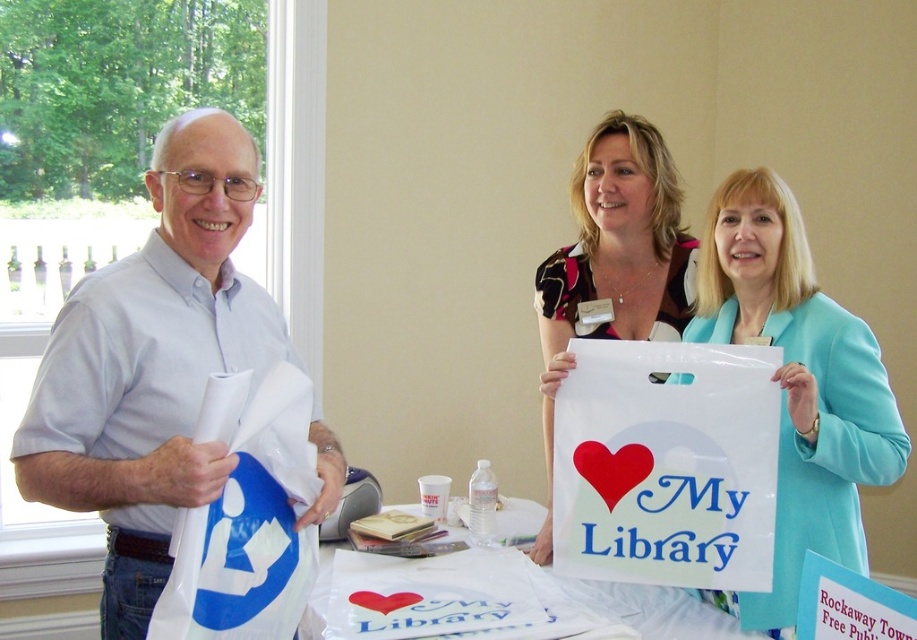
Does printed fabric heart at center have a smaller size compared to white plastic bag at center?

Incorrect, printed fabric heart at center is not smaller in size than white plastic bag at center.

How much distance is there between printed fabric heart at center and white plastic bag at center?

printed fabric heart at center is 26.14 inches from white plastic bag at center.

Who is more forward, (685, 257) or (558, 579)?

Point (558, 579) is more forward.

Locate an element on the screen. The width and height of the screenshot is (917, 640). printed fabric heart at center is located at coordinates (613, 260).

In the scene shown: How distant is teal fabric jacket at center from white plastic bag at center?

The distance of teal fabric jacket at center from white plastic bag at center is 17.19 inches.

Who is more forward, (810, 362) or (724, 614)?

Point (810, 362)

At what (x,y) coordinates should I click in order to perform the action: click on teal fabric jacket at center. Please return your answer as a coordinate pair (x, y). The height and width of the screenshot is (640, 917). Looking at the image, I should click on (797, 385).

Image resolution: width=917 pixels, height=640 pixels. Identify the location of teal fabric jacket at center. (797, 385).

Is teal fabric jacket at center wider than printed fabric heart at center?

Incorrect, teal fabric jacket at center's width does not surpass printed fabric heart at center's.

Which is above, teal fabric jacket at center or printed fabric heart at center?

printed fabric heart at center

Is point (842, 508) farther from camera compared to point (621, 275)?

That is False.

In order to click on teal fabric jacket at center in this screenshot , I will do `click(797, 385)`.